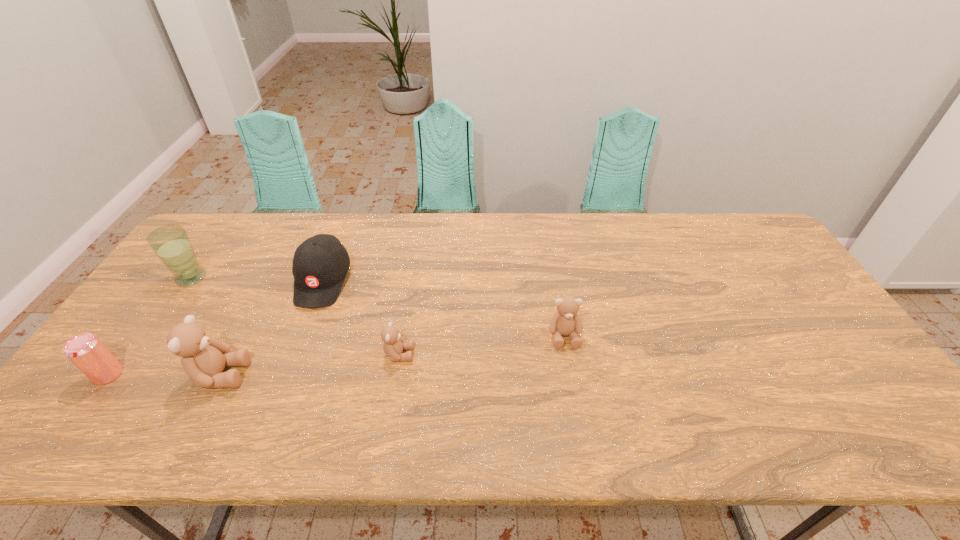
The teddy bears are evenly distributed in the image. To maintain this, where would you place another teddy bear on the right? Please point to a free space. Please provide its 2D coordinates. Your answer should be formatted as a tuple, i.e. [(x, y)], where the tuple contains the x and y coordinates of a point satisfying the conditions above.

[(717, 319)]